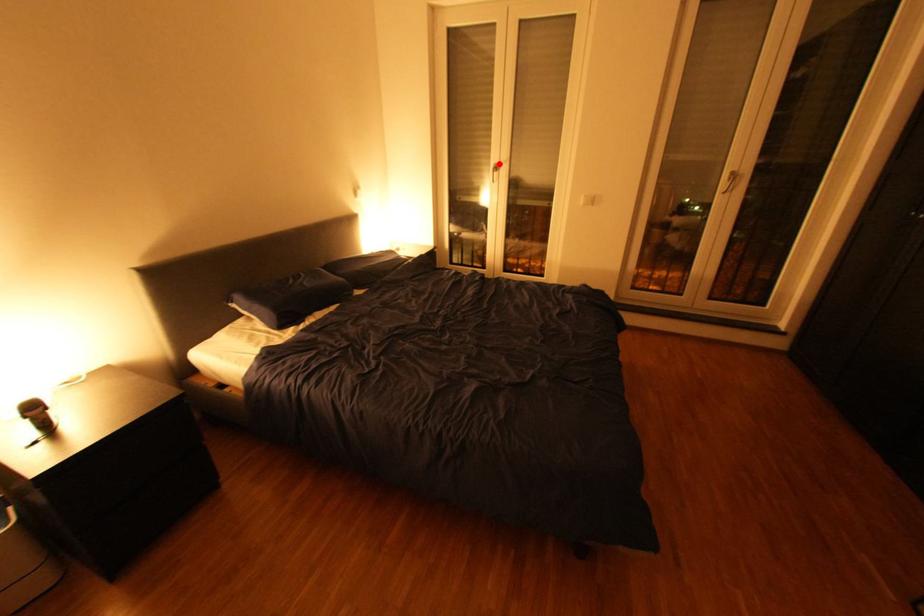
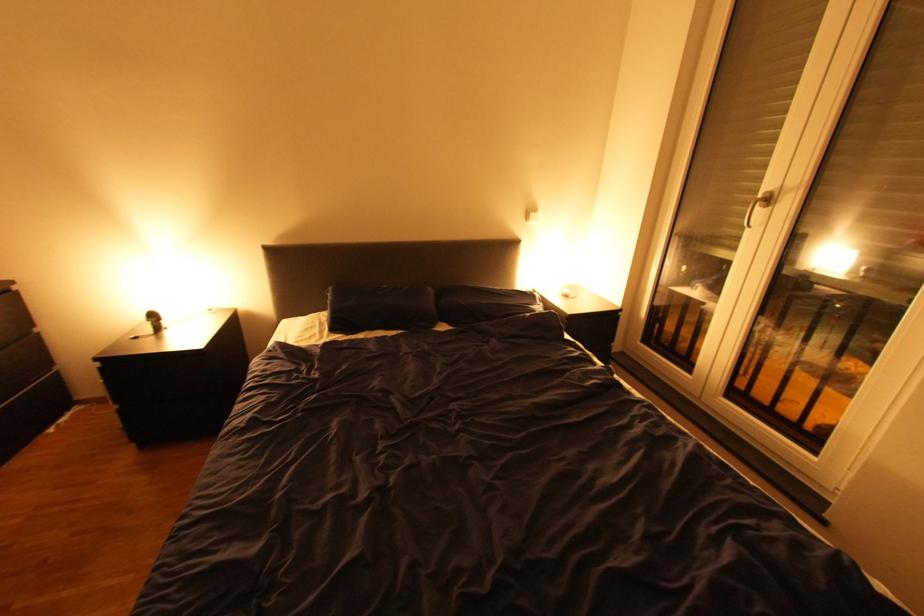
In the second image, find the point that corresponds to the highlighted location in the first image.

(767, 192)